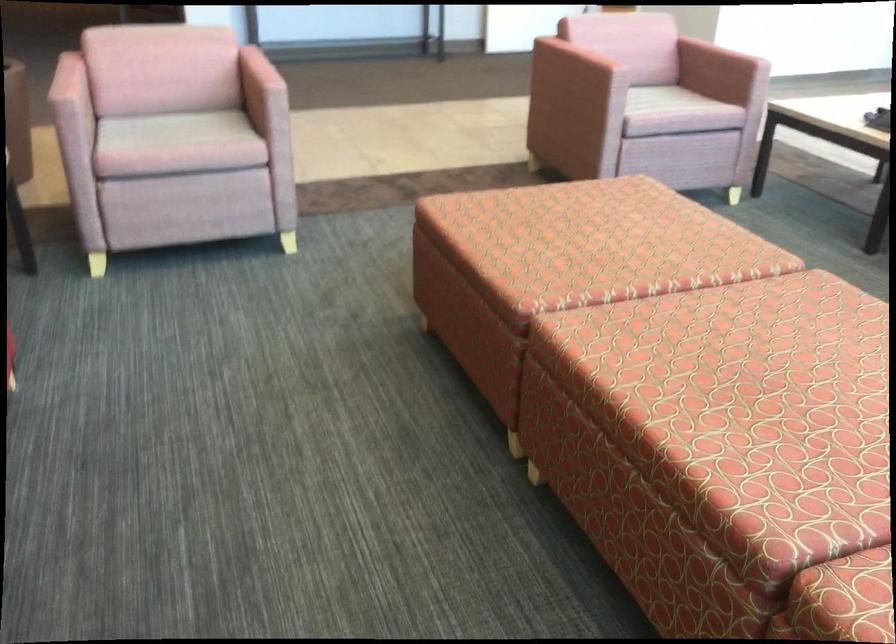
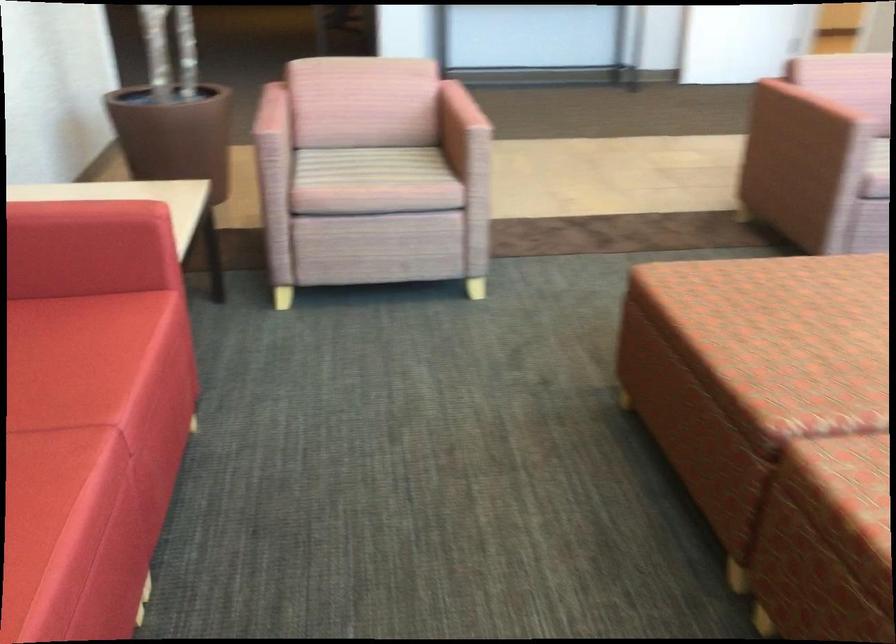
Find the pixel in the second image that matches [563,219] in the first image.

(805, 304)